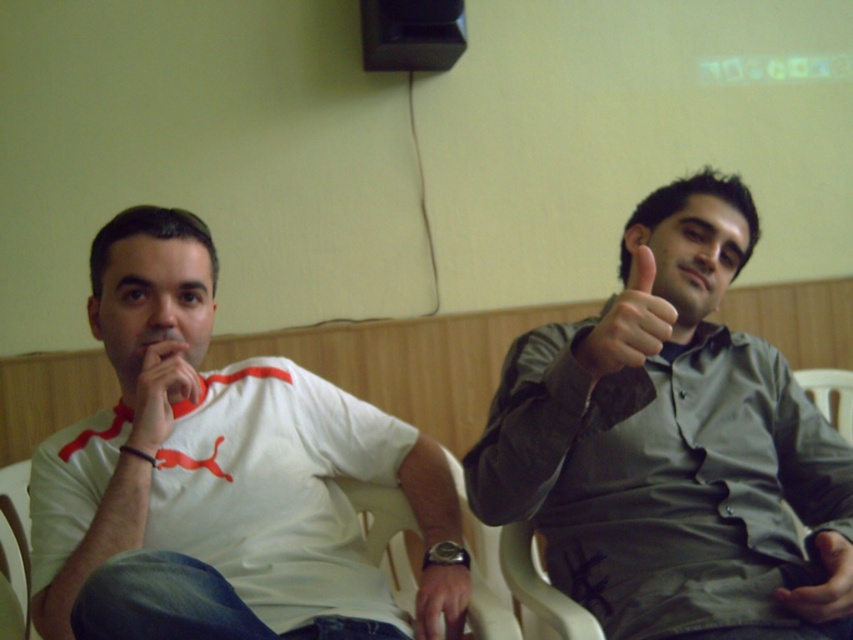
Question: Among these objects, which one is nearest to the camera?

Choices:
 (A) matte black hand at center
 (B) white plastic chair at left
 (C) smooth leather watch at lower center
 (D) white matte t-shirt at left

Answer: (D)

Question: Which of the following is the closest to the observer?

Choices:
 (A) (22, 508)
 (B) (848, 616)

Answer: (B)

Question: Which point appears farthest from the camera in this image?

Choices:
 (A) (27, 465)
 (B) (589, 349)
 (C) (28, 620)

Answer: (C)

Question: Can you confirm if white matte t-shirt at left is positioned to the left of white plastic chair at center?

Choices:
 (A) yes
 (B) no

Answer: (B)

Question: Does gray matte shirt at upper right appear under matte black hand at center?

Choices:
 (A) yes
 (B) no

Answer: (B)

Question: Can you confirm if matte white hand at center is positioned to the left of smooth leather watch at lower center?

Choices:
 (A) no
 (B) yes

Answer: (B)